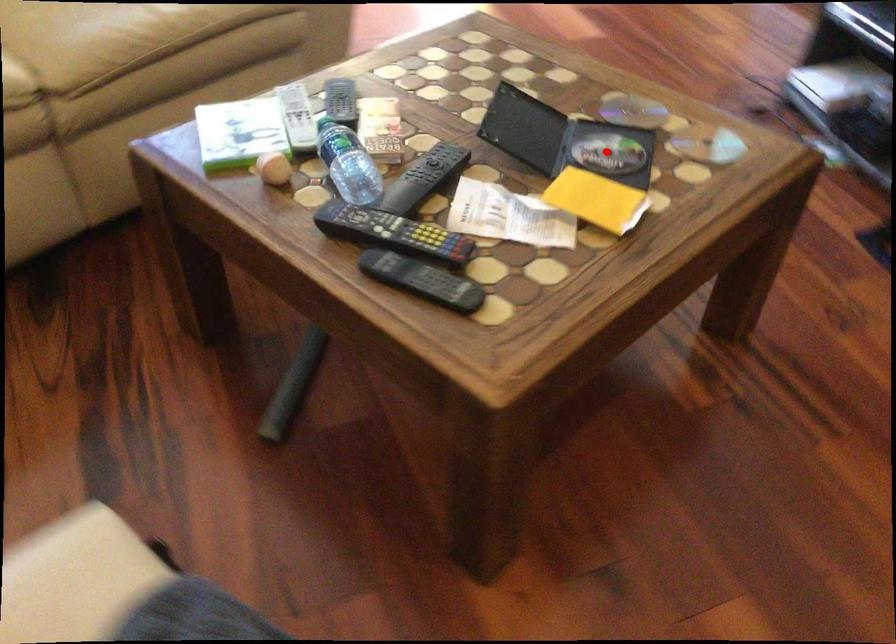
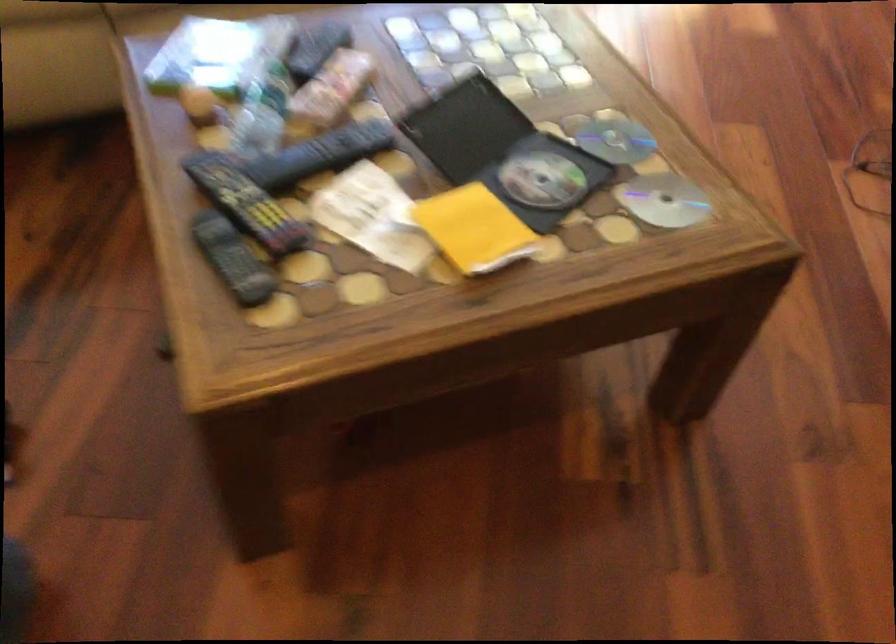
Locate, in the second image, the point that corresponds to the highlighted location in the first image.

(541, 180)